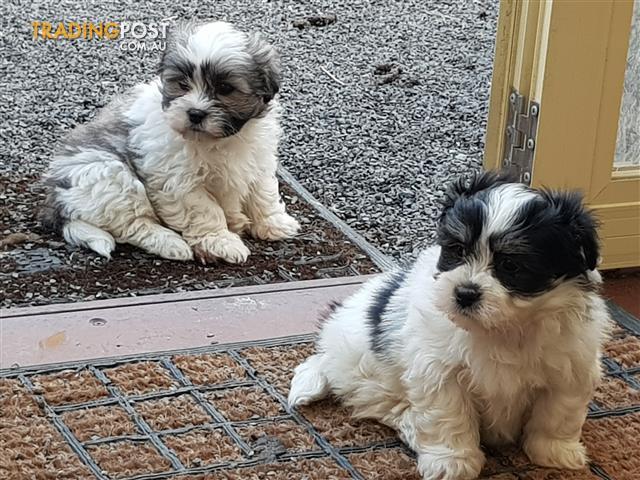
This screenshot has width=640, height=480. Identify the location of square flooring. (182, 403), (621, 398).